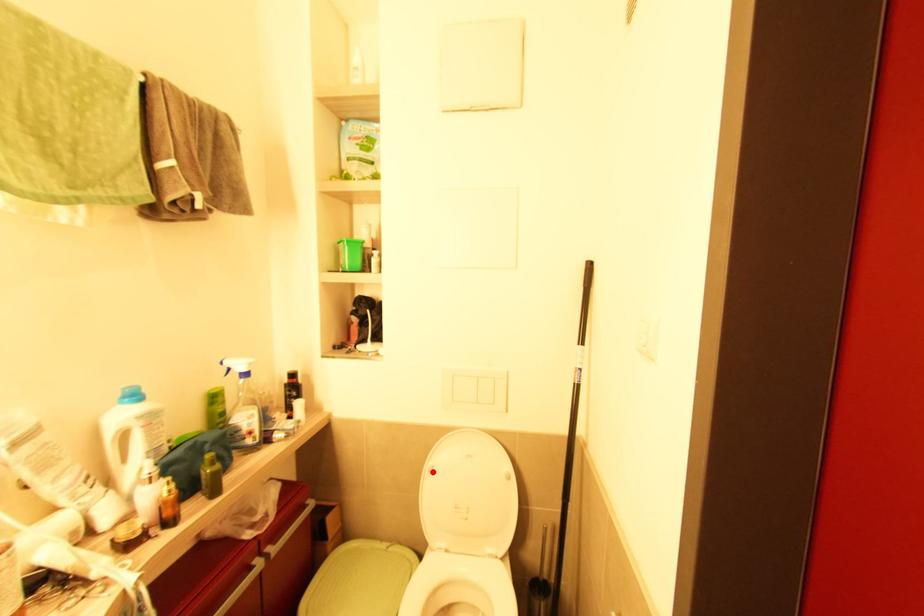
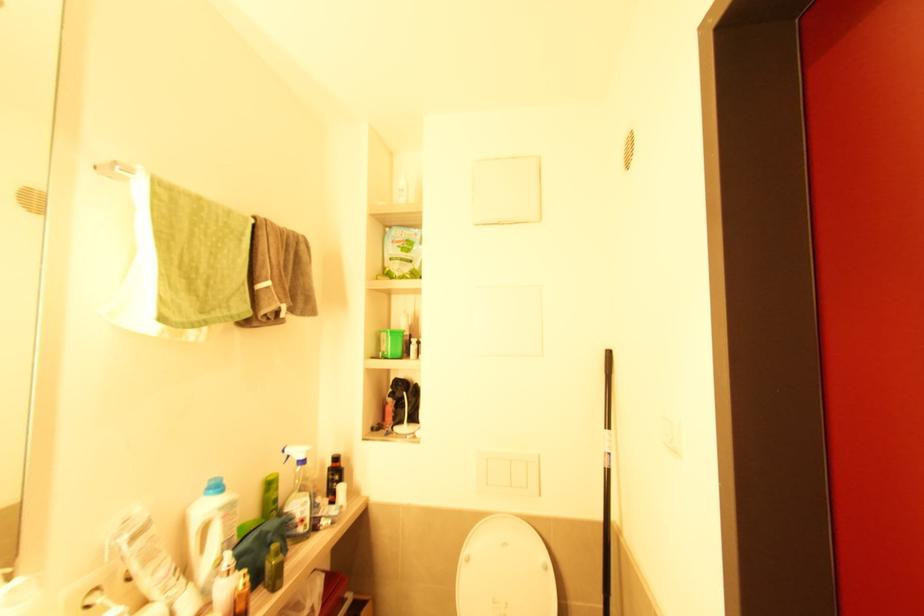
Find the pixel in the second image that matches the highlighted location in the first image.

(469, 561)